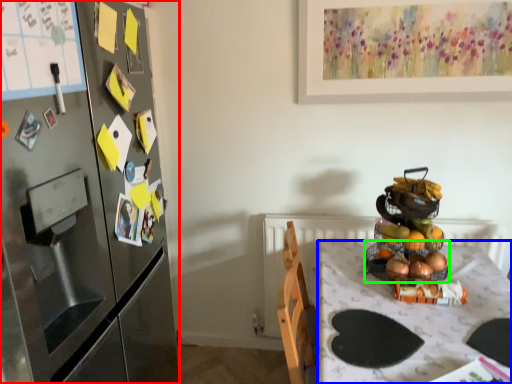
Question: Which object is the farthest from cabinetry (highlighted by a red box)? Choose among these: desk (highlighted by a blue box) or basket (highlighted by a green box).

Choices:
 (A) desk
 (B) basket

Answer: (B)